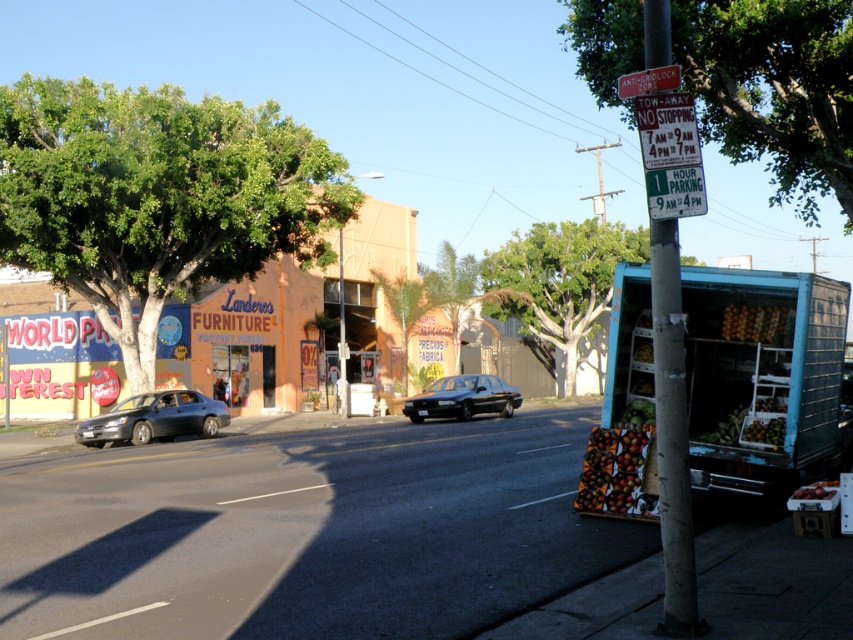
You are a painter standing at the center of the street. You want to paint both the green leafy tree at upper left and the green leafy tree at upper right. Which tree will require a smaller canvas width to capture its full width?

The green leafy tree at upper left has a lesser width compared to the green leafy tree at upper right, so the green leafy tree at upper left will require a smaller canvas width to capture its full width.